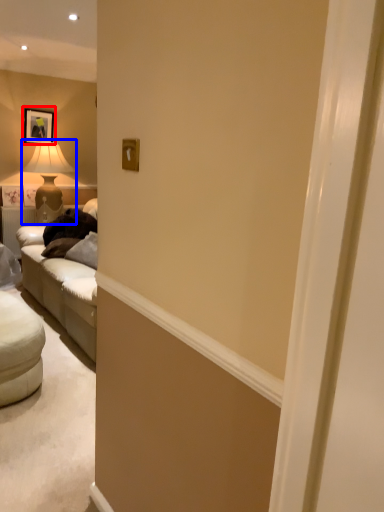
Question: Which point is closer to the camera, picture frame (highlighted by a red box) or table lamp (highlighted by a blue box)?

Choices:
 (A) picture frame
 (B) table lamp

Answer: (B)